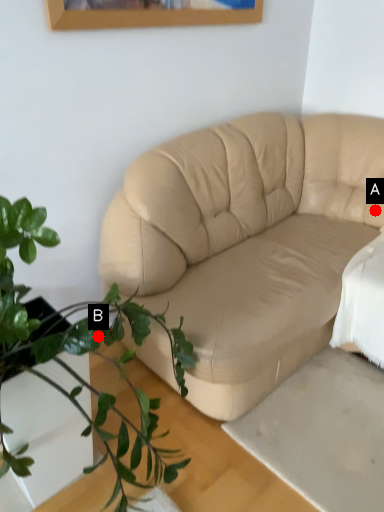
Question: Two points are circled on the image, labeled by A and B beside each circle. Which point is closer to the camera taking this photo?

Choices:
 (A) A is closer
 (B) B is closer

Answer: (B)